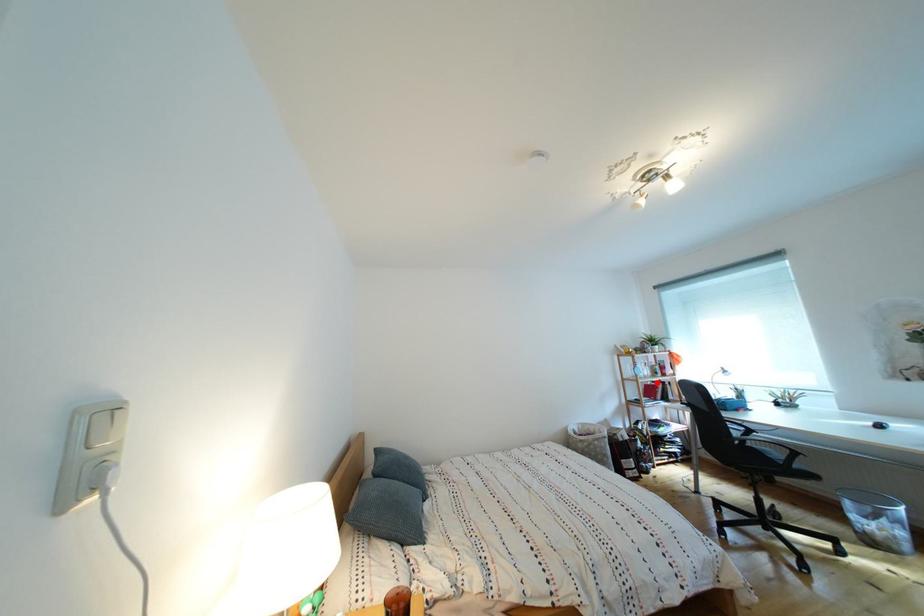
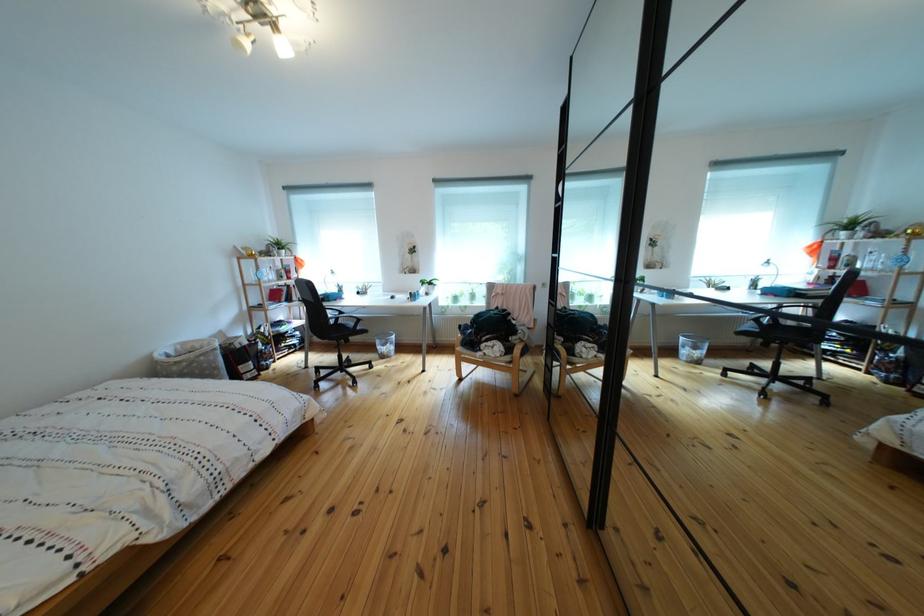
Where in the second image is the point corresponding to the highlighted location from the first image?

(282, 286)